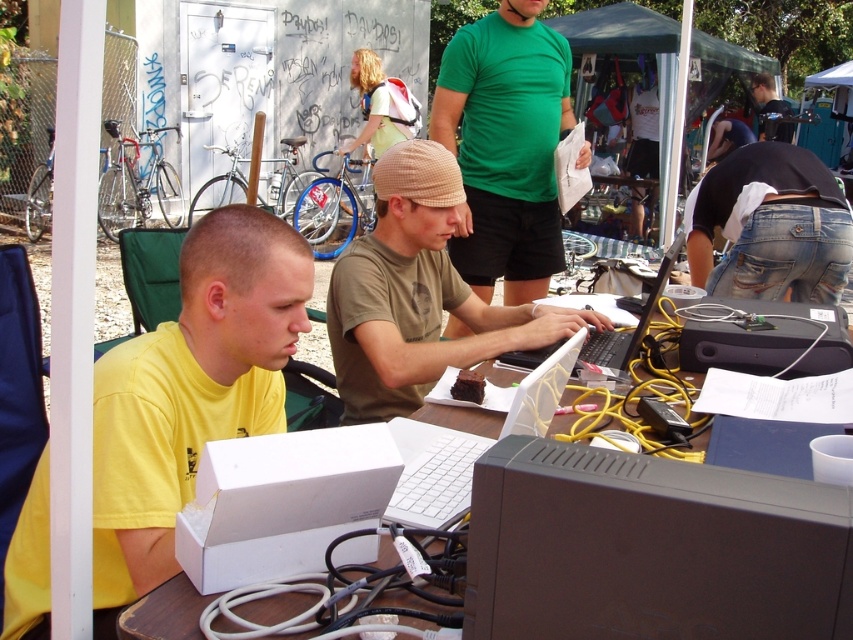
Question: Observing the image, what is the correct spatial positioning of jeans at center in reference to brown wooden table at lower left?

Choices:
 (A) left
 (B) right

Answer: (B)

Question: Which object appears closest to the camera in this image?

Choices:
 (A) dark green t-shirt at upper right
 (B) yellow matte shirt at left

Answer: (B)

Question: From the image, what is the correct spatial relationship of yellow matte shirt at left in relation to black plastic laptop at center?

Choices:
 (A) above
 (B) below

Answer: (B)

Question: Among these points, which one is farthest from the camera?

Choices:
 (A) (656, 292)
 (B) (769, 138)
 (C) (483, 368)

Answer: (B)

Question: Which object is farther from the camera taking this photo?

Choices:
 (A) khaki cotton cap at center
 (B) white plastic laptop at center
 (C) yellow matte shirt at left

Answer: (A)

Question: Does white plastic laptop at center have a lesser width compared to black plastic laptop at center?

Choices:
 (A) no
 (B) yes

Answer: (B)